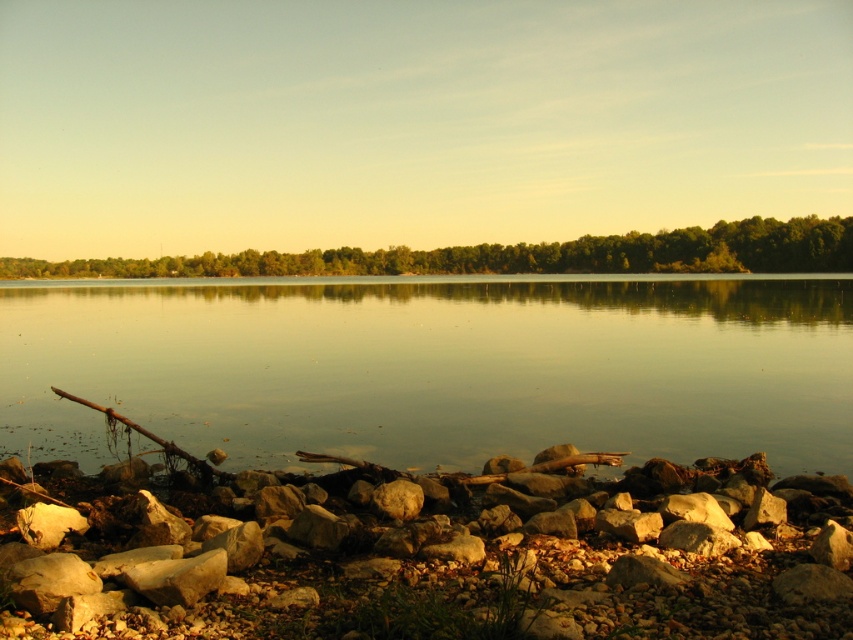
You are a hiker who wants to take a photo of the smooth gray rock at lower center and the green leafy trees at center. Which object will require you to zoom in more to capture it in detail?

The smooth gray rock at lower center occupies less space than the green leafy trees at center, so you will need to zoom in more to capture the smooth gray rock at lower center in detail.

You are standing at the lakeside and want to take a photo of both the clear water at center and the green leafy trees at center. Which object should you focus on first to ensure both are in sharp focus?

The clear water at center is closer to the viewer than the green leafy trees at center. To ensure both are in sharp focus, you should focus on the clear water at center first, as it is closer, and the green leafy trees at center will be in focus as they are further away but within the depth of field.

You are standing at the lakeside and see two points marked in the image. Which point is closer to you, point (830, 304) or point (556, 474)?

Point (556, 474) is closer to you because it is less further to the camera than point (830, 304).